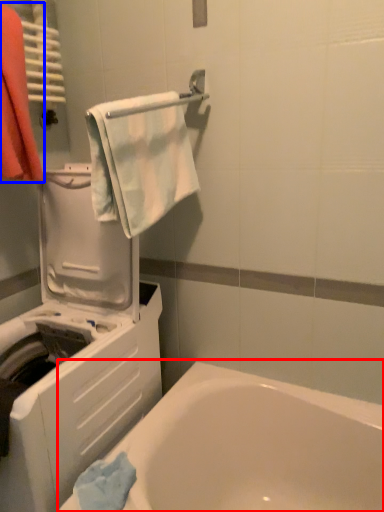
Question: Which point is closer to the camera, bathtub (highlighted by a red box) or laundry (highlighted by a blue box)?

Choices:
 (A) bathtub
 (B) laundry

Answer: (A)